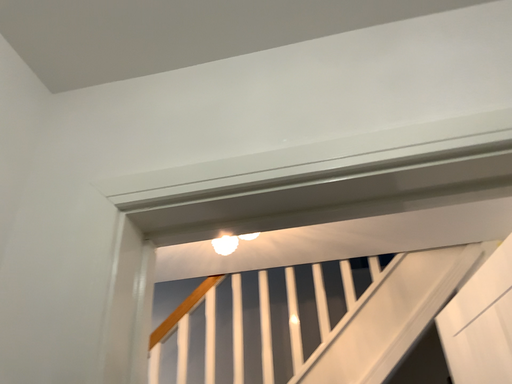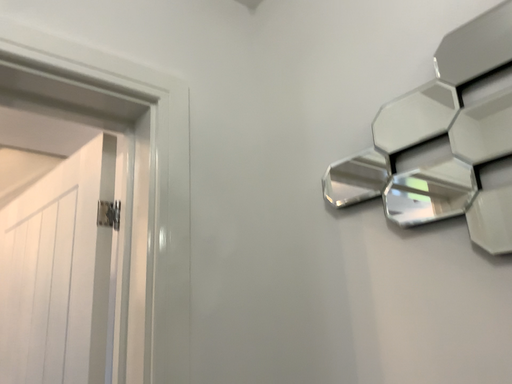
Question: How did the camera likely rotate when shooting the video?

Choices:
 (A) rotated downward
 (B) rotated upward

Answer: (A)